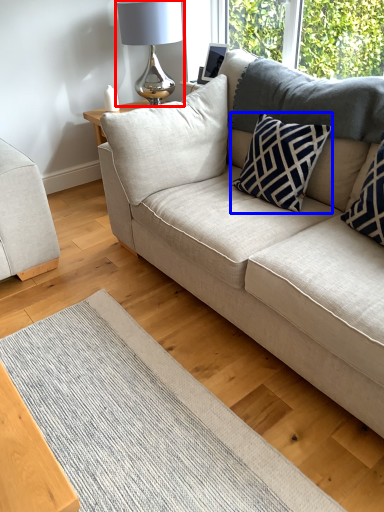
Question: Which object appears closest to the camera in this image, table lamp (highlighted by a red box) or pillow (highlighted by a blue box)?

Choices:
 (A) table lamp
 (B) pillow

Answer: (B)